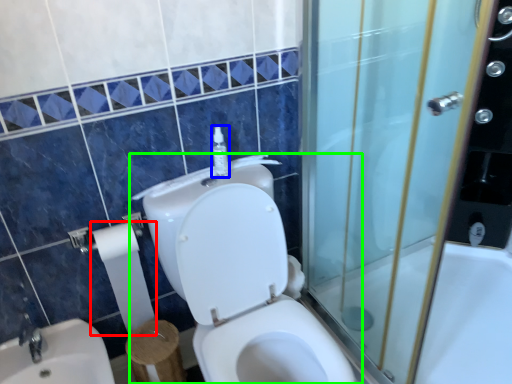
Question: Based on their relative distances, which object is nearer to toilet paper (highlighted by a red box)? Choose from soap dispenser (highlighted by a blue box) and toilet (highlighted by a green box).

Choices:
 (A) soap dispenser
 (B) toilet

Answer: (B)